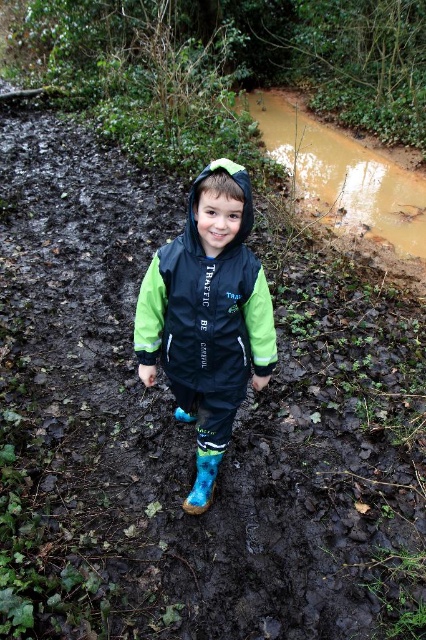
Question: Which of the following is the closest to the observer?

Choices:
 (A) (150, 339)
 (B) (201, 496)

Answer: (A)

Question: Can you confirm if black matte jacket at center is thinner than blue rubber boot at center?

Choices:
 (A) no
 (B) yes

Answer: (A)

Question: Can you confirm if black matte jacket at center is positioned below blue rubber boot at center?

Choices:
 (A) yes
 (B) no

Answer: (B)

Question: Can you confirm if black matte jacket at center is smaller than blue rubber boot at center?

Choices:
 (A) yes
 (B) no

Answer: (B)

Question: Which of the following is the closest to the observer?

Choices:
 (A) (189, 493)
 (B) (172, 352)

Answer: (B)